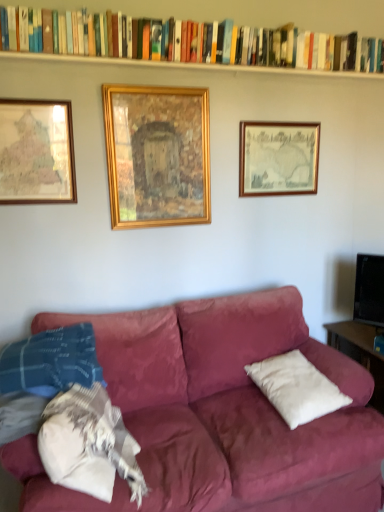
Question: Is wooden framed map at upper right, the first picture frame in the right-to-left sequence, bigger than white painted wood at upper center?

Choices:
 (A) yes
 (B) no

Answer: (A)

Question: Does wooden framed map at upper right, the third picture frame viewed from the left, have a greater height compared to white painted wood at upper center?

Choices:
 (A) yes
 (B) no

Answer: (A)

Question: Considering the relative sizes of wooden framed map at upper right, the first picture frame in the right-to-left sequence, and white painted wood at upper center in the image provided, is wooden framed map at upper right, the first picture frame in the right-to-left sequence, smaller than white painted wood at upper center?

Choices:
 (A) yes
 (B) no

Answer: (B)

Question: From a real-world perspective, is wooden framed map at upper right, the third picture frame viewed from the left, below white painted wood at upper center?

Choices:
 (A) yes
 (B) no

Answer: (A)

Question: Can we say wooden framed map at upper right, the third picture frame viewed from the left, lies outside white painted wood at upper center?

Choices:
 (A) no
 (B) yes

Answer: (B)

Question: Is wooden framed map at upper right, the third picture frame viewed from the left, to the left or to the right of wooden map at left, which ranks as the 3th picture frame in right-to-left order, in the image?

Choices:
 (A) left
 (B) right

Answer: (B)

Question: Is wooden framed map at upper right, the first picture frame in the right-to-left sequence, situated inside wooden map at left, placed as the 1th picture frame when sorted from left to right, or outside?

Choices:
 (A) inside
 (B) outside

Answer: (B)

Question: Looking at the image, does wooden framed map at upper right, the third picture frame viewed from the left, seem bigger or smaller compared to wooden map at left, placed as the 1th picture frame when sorted from left to right?

Choices:
 (A) big
 (B) small

Answer: (A)

Question: Is wooden framed map at upper right, the third picture frame viewed from the left, taller or shorter than wooden map at left, placed as the 1th picture frame when sorted from left to right?

Choices:
 (A) short
 (B) tall

Answer: (A)

Question: From a real-world perspective, is hardcover book at upper center above or below wooden framed map at upper right, the third picture frame viewed from the left?

Choices:
 (A) below
 (B) above

Answer: (B)

Question: Relative to wooden framed map at upper right, the first picture frame in the right-to-left sequence, is hardcover book at upper center in front or behind?

Choices:
 (A) behind
 (B) front

Answer: (B)

Question: Considering the positions of hardcover book at upper center and wooden framed map at upper right, the third picture frame viewed from the left, in the image, is hardcover book at upper center taller or shorter than wooden framed map at upper right, the third picture frame viewed from the left,?

Choices:
 (A) tall
 (B) short

Answer: (B)

Question: Is hardcover book at upper center inside the boundaries of wooden framed map at upper right, the first picture frame in the right-to-left sequence, or outside?

Choices:
 (A) inside
 (B) outside

Answer: (B)

Question: From the image's perspective, is wooden framed map at upper right, the first picture frame in the right-to-left sequence, positioned above or below gold wooden frame at center, the 2th picture frame from the left?

Choices:
 (A) below
 (B) above

Answer: (B)

Question: Looking at their shapes, would you say wooden framed map at upper right, the third picture frame viewed from the left, is wider or thinner than gold wooden frame at center, the 2th picture frame from the right?

Choices:
 (A) wide
 (B) thin

Answer: (B)